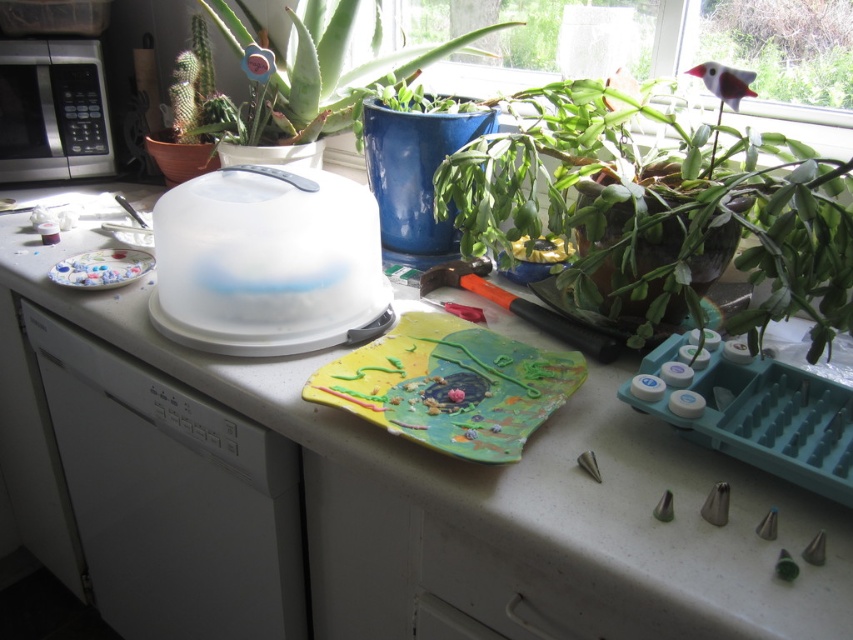
Question: Is white plastic tray at center thinner than matte plastic plate at left?

Choices:
 (A) no
 (B) yes

Answer: (A)

Question: Which of the following is the closest to the observer?

Choices:
 (A) (619, 445)
 (B) (737, 58)
 (C) (491, 224)
 (D) (96, 289)

Answer: (A)

Question: Where is white plastic tray at center located in relation to silver metallic microwave at left in the image?

Choices:
 (A) left
 (B) right

Answer: (B)

Question: Is leathery green plant at center right further to the viewer compared to green matte aloe vera at upper center?

Choices:
 (A) yes
 (B) no

Answer: (B)

Question: Among these objects, which one is nearest to the camera?

Choices:
 (A) white plastic tray at center
 (B) green matte aloe vera at upper center

Answer: (A)

Question: Which object is the closest to the green matte aloe vera at upper center?

Choices:
 (A) white plastic tray at center
 (B) matte plastic plate at left
 (C) leathery green plant at center right

Answer: (C)